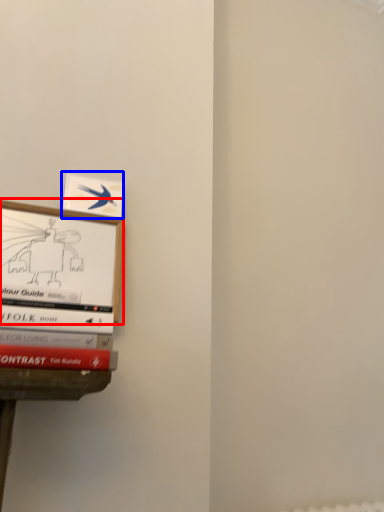
Question: Which of the following is the farthest to the observer, picture frame (highlighted by a red box) or book (highlighted by a blue box)?

Choices:
 (A) picture frame
 (B) book

Answer: (B)